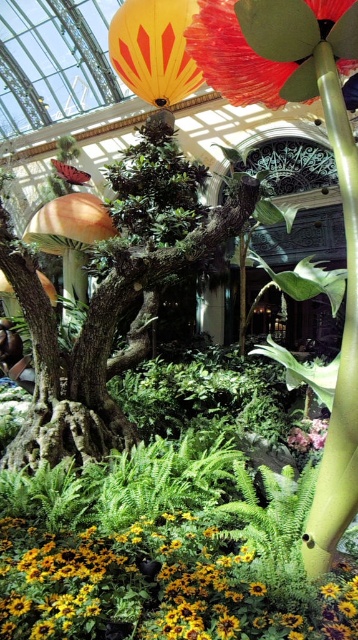
Does yellow matte flower at lower center lie behind yellow paper lantern at upper center?

No, it is not.

Who is taller, yellow matte flower at lower center or yellow paper lantern at upper center?

Standing taller between the two is yellow paper lantern at upper center.

You are a GUI agent. You are given a task and a screenshot of the screen. Output one action in this format:
    pyautogui.click(x=<x>, y=<y>)
    Task: Click on the yellow matte flower at lower center
    This screenshot has width=358, height=640.
    Given the screenshot: What is the action you would take?
    pyautogui.click(x=157, y=588)

Locate an element on the screen. Image resolution: width=358 pixels, height=640 pixels. yellow matte flower at lower center is located at coordinates (157, 588).

Who is higher up, yellow paper lantern at upper center or silky pink petals at center?

yellow paper lantern at upper center is above.

The image size is (358, 640). I want to click on yellow paper lantern at upper center, so click(x=153, y=49).

Who is positioned more to the left, yellow matte flower at lower center or silky pink petals at center?

Positioned to the left is yellow matte flower at lower center.

Can you confirm if yellow matte flower at lower center is wider than silky pink petals at center?

Yes.

At what (x,y) coordinates should I click in order to perform the action: click on yellow matte flower at lower center. Please return your answer as a coordinate pair (x, y). The image size is (358, 640). Looking at the image, I should click on (157, 588).

Identify the location of yellow matte flower at lower center. (157, 588).